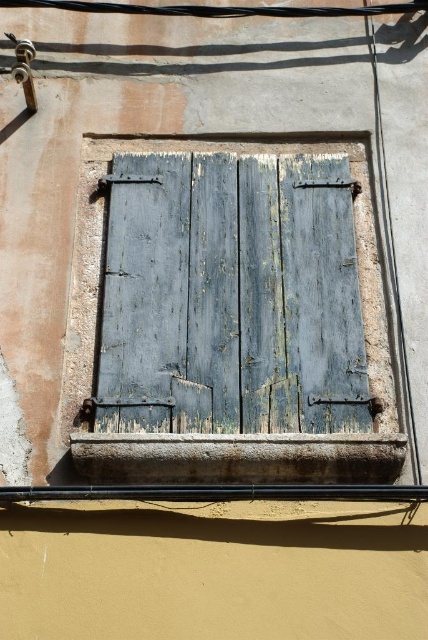
This screenshot has height=640, width=428. I want to click on weathered wood shutters at center, so click(229, 316).

Is weathered wood shutters at center shorter than rusty concrete window sill at lower center?

No, weathered wood shutters at center is not shorter than rusty concrete window sill at lower center.

Is point (178, 422) positioned behind point (71, 449)?

Yes, point (178, 422) is farther from viewer.

Find the location of a particular element. Image resolution: width=428 pixels, height=640 pixels. weathered wood shutters at center is located at coordinates (229, 316).